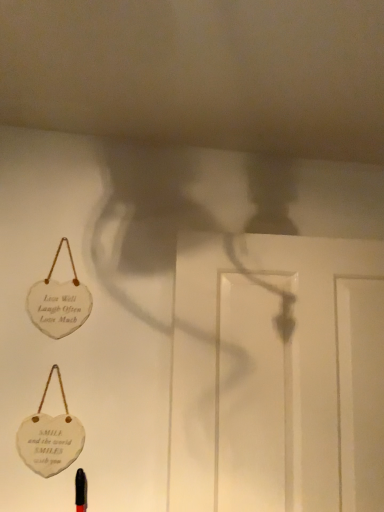
Question: From a real-world perspective, is white glossy door at center on white wood heart at upper left?

Choices:
 (A) yes
 (B) no

Answer: (B)

Question: Can you confirm if white glossy door at center is positioned to the right of white wood heart at upper left?

Choices:
 (A) no
 (B) yes

Answer: (B)

Question: From the image's perspective, is white glossy door at center on white wood heart at upper left?

Choices:
 (A) yes
 (B) no

Answer: (B)

Question: Is white glossy door at center located outside white wood heart at upper left?

Choices:
 (A) yes
 (B) no

Answer: (A)

Question: From a real-world perspective, is white glossy door at center below white wood heart at upper left?

Choices:
 (A) no
 (B) yes

Answer: (B)

Question: Is white glossy door at center far away from white wood heart at upper left?

Choices:
 (A) no
 (B) yes

Answer: (A)

Question: From the image's perspective, is white wood heart at upper left beneath white glossy door at center?

Choices:
 (A) yes
 (B) no

Answer: (B)

Question: Considering the relative sizes of white wood heart at upper left and white glossy door at center in the image provided, is white wood heart at upper left bigger than white glossy door at center?

Choices:
 (A) yes
 (B) no

Answer: (B)

Question: Is white wood heart at upper left facing towards white glossy door at center?

Choices:
 (A) no
 (B) yes

Answer: (A)

Question: Is white wood heart at upper left positioned far away from white glossy door at center?

Choices:
 (A) yes
 (B) no

Answer: (B)

Question: Would you say white wood heart at upper left contains white glossy door at center?

Choices:
 (A) no
 (B) yes

Answer: (A)

Question: From a real-world perspective, is white wood heart at upper left positioned over white glossy door at center based on gravity?

Choices:
 (A) no
 (B) yes

Answer: (B)

Question: In the image, is white glossy door at center on the left side or the right side of white wood heart at upper left?

Choices:
 (A) left
 (B) right

Answer: (B)